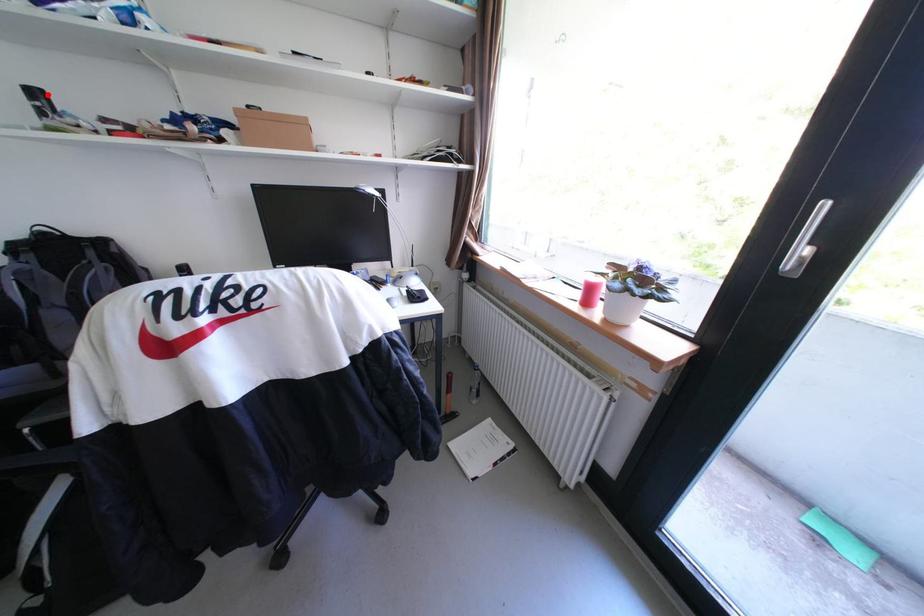
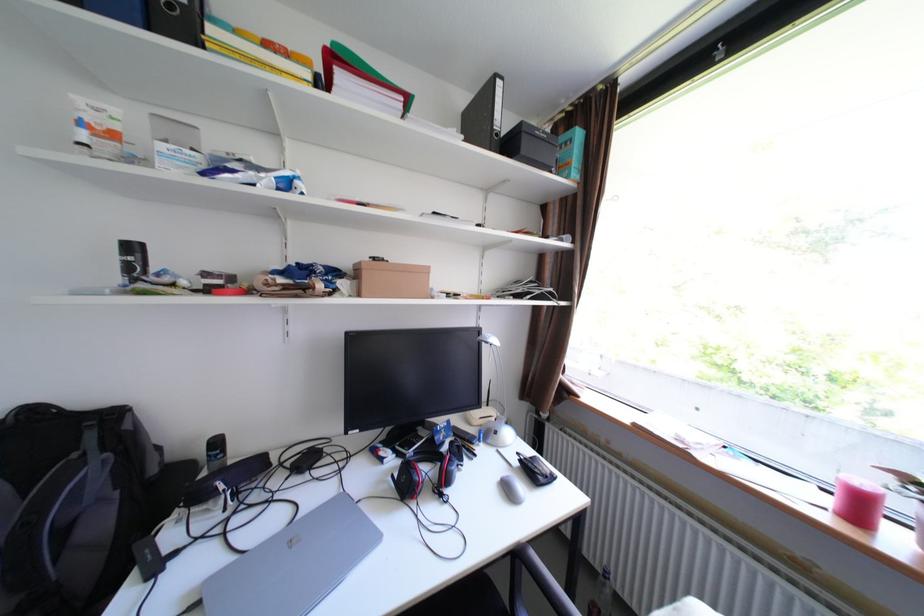
Question: I am providing you with two images of the same scene from different viewpoints. Given a red point in image1, look at the same physical point in image2. Is it:

Choices:
 (A) Closer to the viewpoint
 (B) Farther from the viewpoint

Answer: (A)